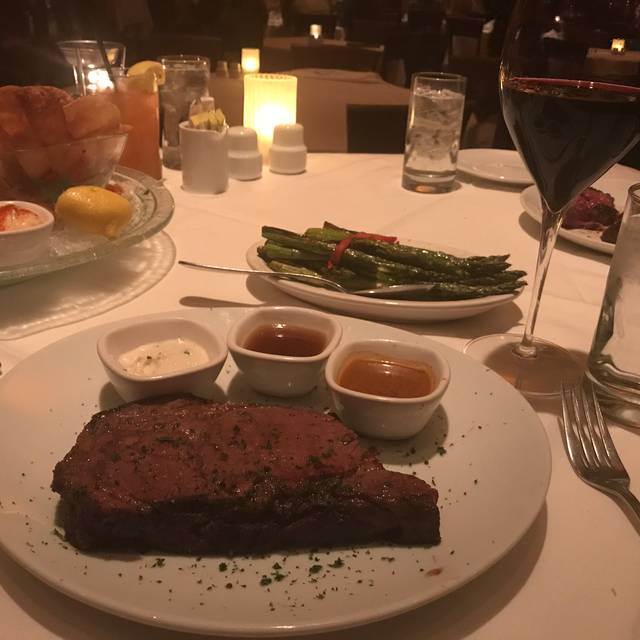
Identify the location of silver spoon. This screenshot has width=640, height=640. (399, 289).